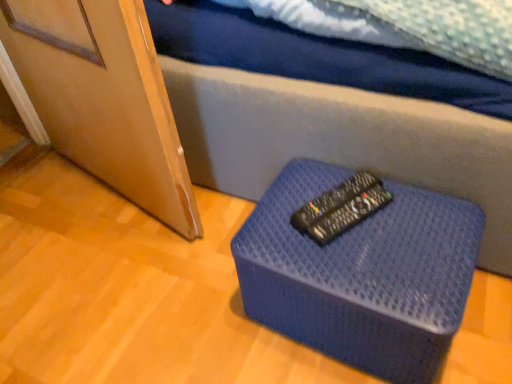
You are a GUI agent. You are given a task and a screenshot of the screen. Output one action in this format:
    pyautogui.click(x=<x>, y=<y>)
    Task: Click on the vacant area that is in front of black plastic remote at center
    The width and height of the screenshot is (512, 384).
    Given the screenshot: What is the action you would take?
    pyautogui.click(x=370, y=263)